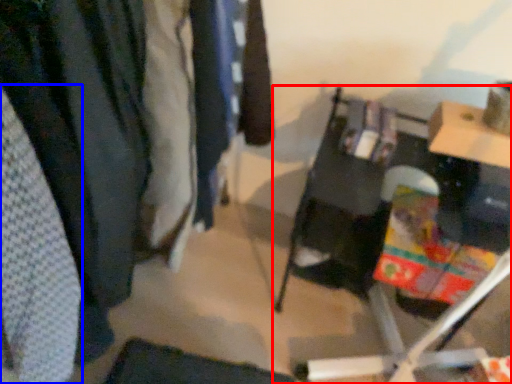
Question: Among these objects, which one is farthest to the camera, furniture (highlighted by a red box) or clothing (highlighted by a blue box)?

Choices:
 (A) furniture
 (B) clothing

Answer: (A)